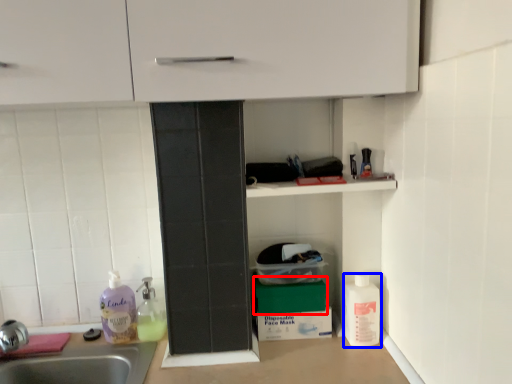
Question: Which object is closer to the camera taking this photo, box (highlighted by a red box) or cleaning product (highlighted by a blue box)?

Choices:
 (A) box
 (B) cleaning product

Answer: (B)